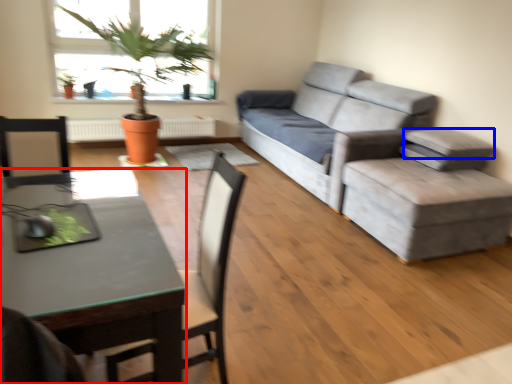
Question: Which point is further to the camera, desk (highlighted by a red box) or pillow (highlighted by a blue box)?

Choices:
 (A) desk
 (B) pillow

Answer: (B)